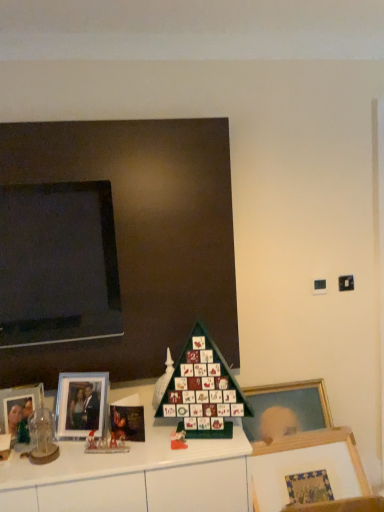
Locate an element on the screen. The image size is (384, 512). spots to the right of clear glass dome at left, arranged as the 3th toy when viewed from the right is located at coordinates (86, 455).